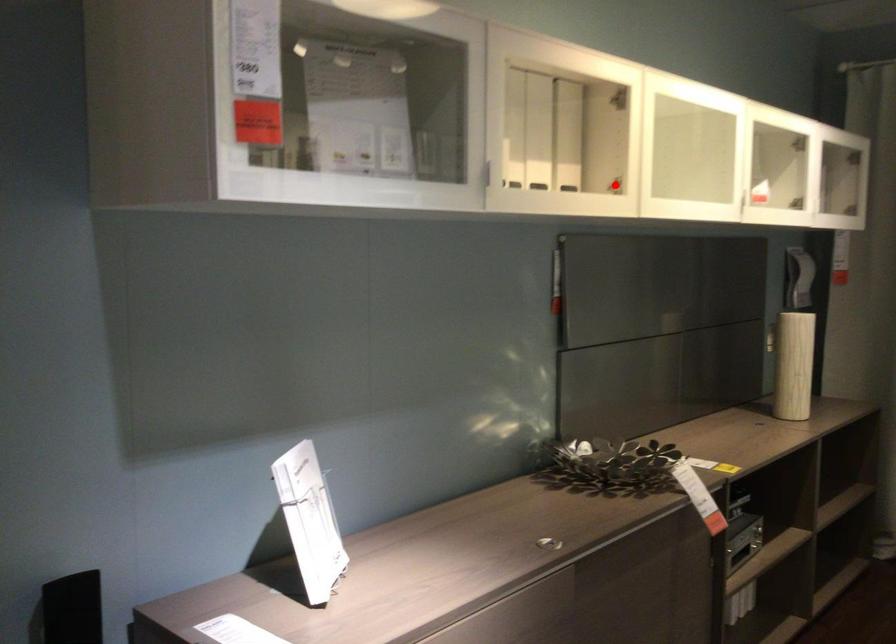
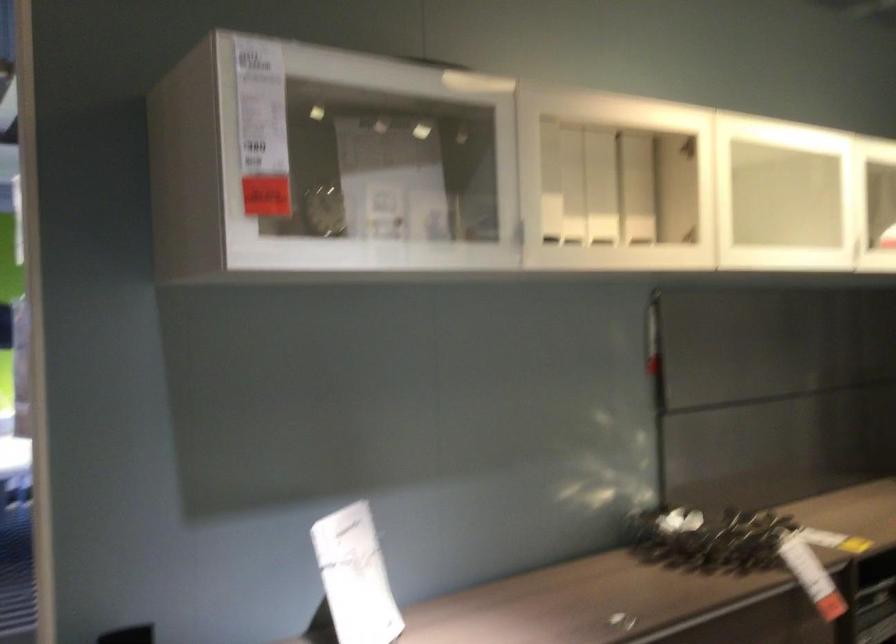
Locate, in the second image, the point that corresponds to the highlighted location in the first image.

(690, 234)